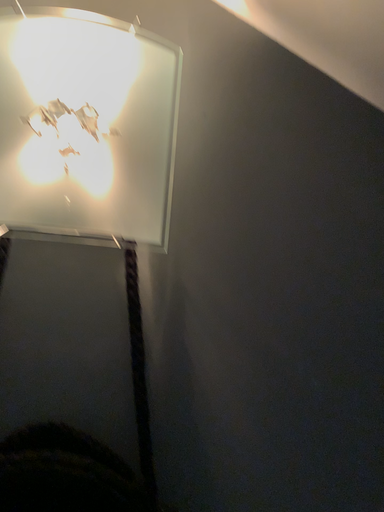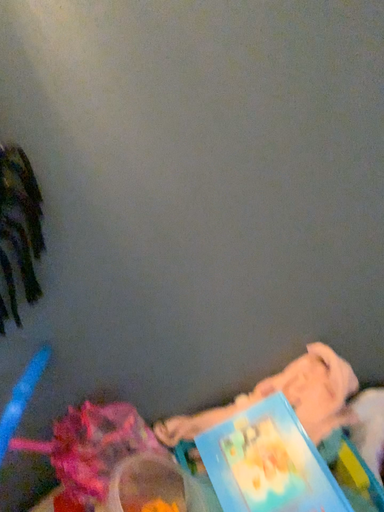
Question: How did the camera likely rotate when shooting the video?

Choices:
 (A) rotated left
 (B) rotated right

Answer: (B)